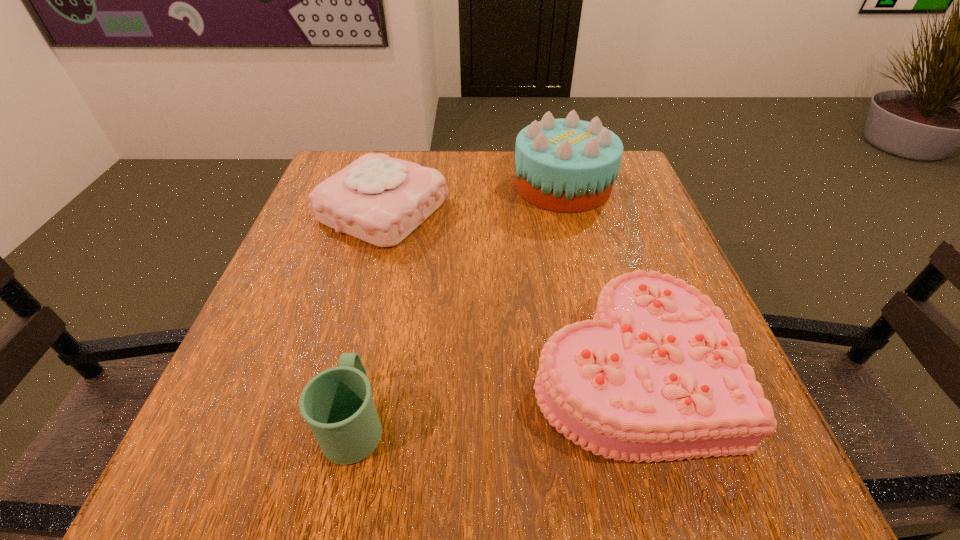
Find the location of a particular element. The height and width of the screenshot is (540, 960). the tallest cake is located at coordinates (568, 165).

Find the location of `mug`. mug is located at coordinates (337, 403).

Locate an element on the screen. the leftmost cake is located at coordinates (378, 199).

Locate an element on the screen. This screenshot has width=960, height=540. the shortest object is located at coordinates (658, 374).

You are a GUI agent. You are given a task and a screenshot of the screen. Output one action in this format:
    pyautogui.click(x=<x>, y=<y>)
    Task: Click on the nearest cake
    This screenshot has height=540, width=960.
    Given the screenshot: What is the action you would take?
    pyautogui.click(x=658, y=374)

Where is `vacant space located on the left of the tallest object`? The image size is (960, 540). vacant space located on the left of the tallest object is located at coordinates (445, 186).

Identify the location of vacant space situated on the side of the mug with the handle. The image size is (960, 540). (380, 308).

Find the location of a particular element. vacant space situated 0.400m on the side of the mug with the handle is located at coordinates (397, 227).

Where is `blank area located 0.220m on the side of the mug with the handle`? blank area located 0.220m on the side of the mug with the handle is located at coordinates (385, 285).

Find the location of `vacant space located on the front of the leftmost cake`. vacant space located on the front of the leftmost cake is located at coordinates (326, 420).